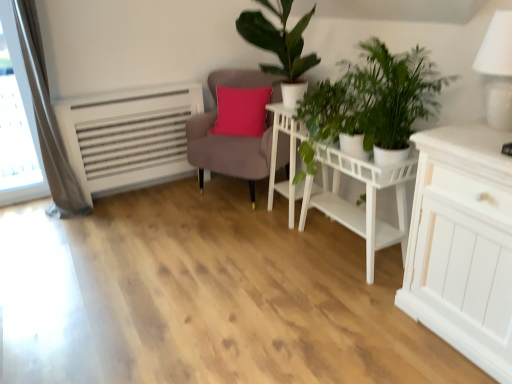
Question: Which direction should I rotate to look at green matte plant at upper center, positioned as the second houseplant in front-to-back order?

Choices:
 (A) left
 (B) right

Answer: (B)

Question: Can you confirm if green leafy plant at center right, which ranks as the second houseplant in back-to-front order, is bigger than white glossy table lamp at upper right?

Choices:
 (A) no
 (B) yes

Answer: (B)

Question: Is green leafy plant at center right, which ranks as the second houseplant in back-to-front order, next to white glossy table lamp at upper right?

Choices:
 (A) no
 (B) yes

Answer: (A)

Question: Can you confirm if green leafy plant at center right, which ranks as the second houseplant in back-to-front order, is taller than white glossy table lamp at upper right?

Choices:
 (A) no
 (B) yes

Answer: (B)

Question: Is green leafy plant at center right, which ranks as the second houseplant in back-to-front order, positioned before white glossy table lamp at upper right?

Choices:
 (A) no
 (B) yes

Answer: (A)

Question: Is white glossy table lamp at upper right surrounded by green leafy plant at center right, which ranks as the second houseplant in back-to-front order?

Choices:
 (A) yes
 (B) no

Answer: (B)

Question: From the image's perspective, is green leafy plant at center right, which is the first houseplant in front-to-back order, on white glossy table lamp at upper right?

Choices:
 (A) no
 (B) yes

Answer: (A)

Question: Is green leafy plant at center right, which ranks as the second houseplant in back-to-front order, in front of white matte table at center?

Choices:
 (A) no
 (B) yes

Answer: (B)

Question: From the image's perspective, is green leafy plant at center right, which ranks as the second houseplant in back-to-front order, under white matte table at center?

Choices:
 (A) yes
 (B) no

Answer: (B)

Question: Can you confirm if green leafy plant at center right, which is the first houseplant in front-to-back order, is positioned to the left of white matte table at center?

Choices:
 (A) no
 (B) yes

Answer: (A)

Question: Is green leafy plant at center right, which ranks as the second houseplant in back-to-front order, far from white matte table at center?

Choices:
 (A) yes
 (B) no

Answer: (B)

Question: Does green leafy plant at center right, which is the first houseplant in front-to-back order, appear on the right side of white matte table at center?

Choices:
 (A) no
 (B) yes

Answer: (B)

Question: Is white matte table at center at the back of green leafy plant at center right, which is the first houseplant in front-to-back order?

Choices:
 (A) yes
 (B) no

Answer: (B)

Question: Is white matte side table at center surrounded by white matte table at center?

Choices:
 (A) yes
 (B) no

Answer: (B)